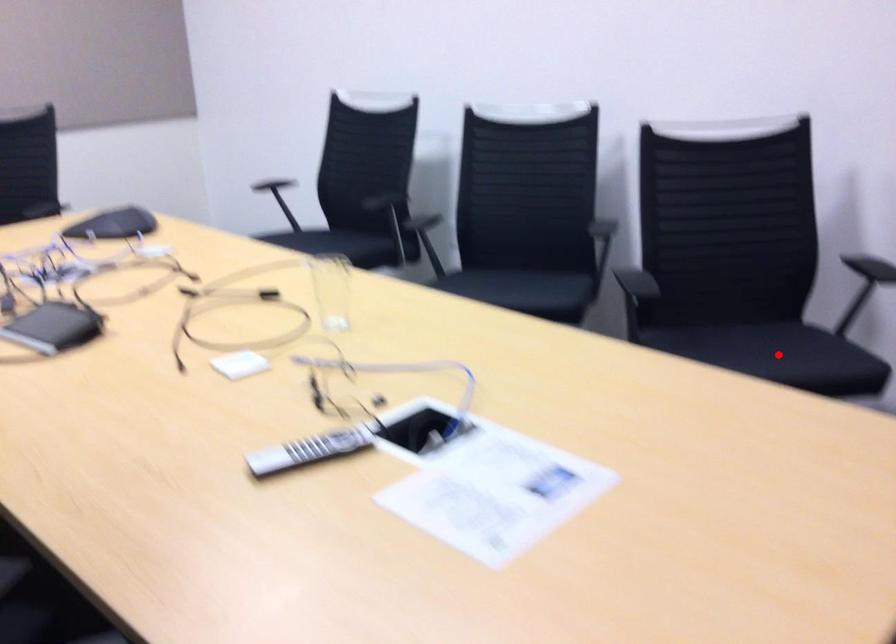
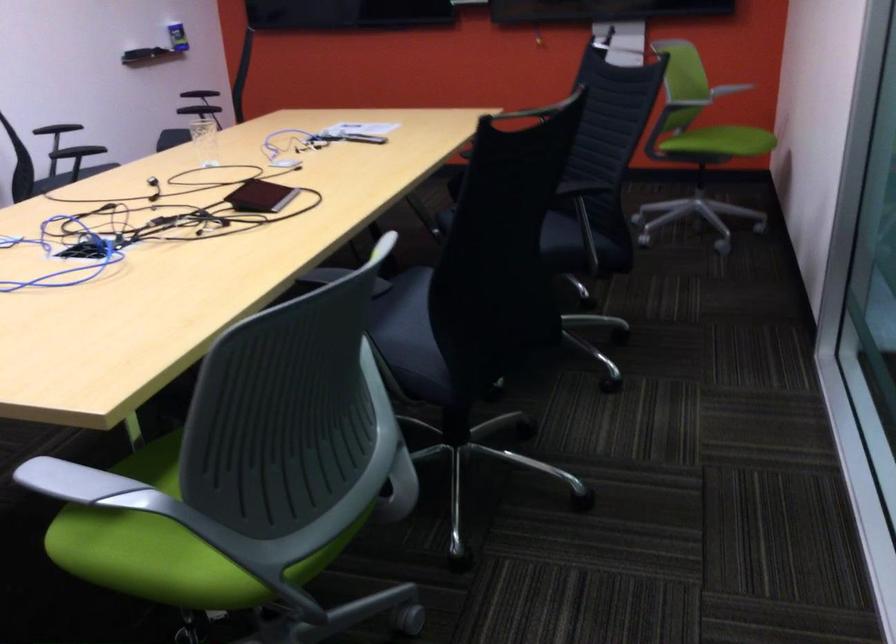
Question: I am providing you with two images of the same scene from different viewpoints. A red point is marked on the first image. Is the red point's position out of view in image 2?

Choices:
 (A) Yes
 (B) No

Answer: (A)